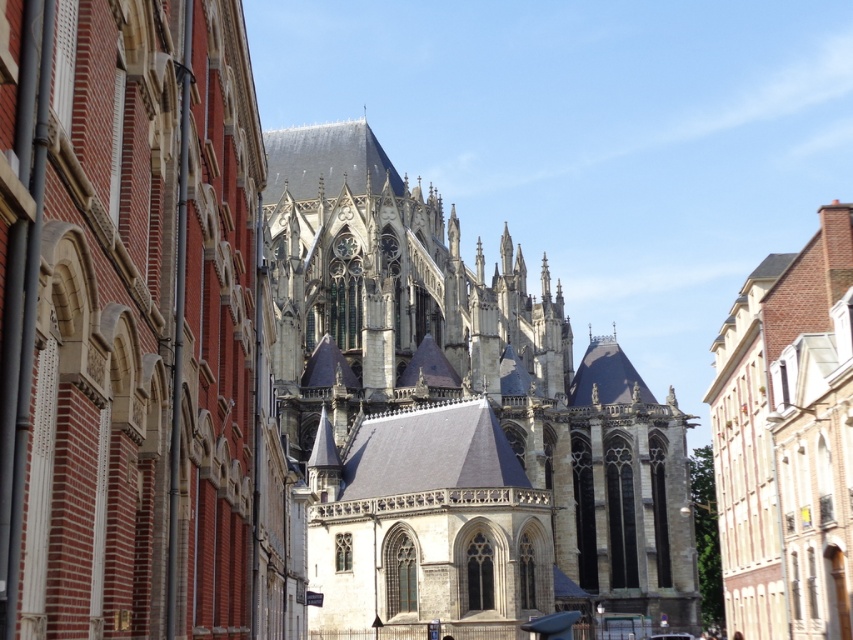
Can you confirm if dark gray stone church at center is taller than brick textured building at right?

Indeed, dark gray stone church at center has a greater height compared to brick textured building at right.

Is point (183, 515) less distant than point (737, 568)?

Yes, point (183, 515) is in front of point (737, 568).

Image resolution: width=853 pixels, height=640 pixels. What do you see at coordinates (134, 326) in the screenshot?
I see `dark gray stone church at center` at bounding box center [134, 326].

Where is `dark gray stone church at center`? Image resolution: width=853 pixels, height=640 pixels. dark gray stone church at center is located at coordinates (134, 326).

Identify the location of dark gray stone church at center. (134, 326).

Who is higher up, dark gray stone church at center or gray stone church at center?

dark gray stone church at center is above.

Does point (187, 250) come farther from viewer compared to point (357, 364)?

No.

Locate an element on the screen. The height and width of the screenshot is (640, 853). dark gray stone church at center is located at coordinates (134, 326).

Is gray stone church at center smaller than brick textured building at right?

Incorrect, gray stone church at center is not smaller in size than brick textured building at right.

Between point (675, 573) and point (746, 534), which one is positioned in front?

Point (746, 534) is in front.

Find the location of a particular element. The width and height of the screenshot is (853, 640). gray stone church at center is located at coordinates (456, 417).